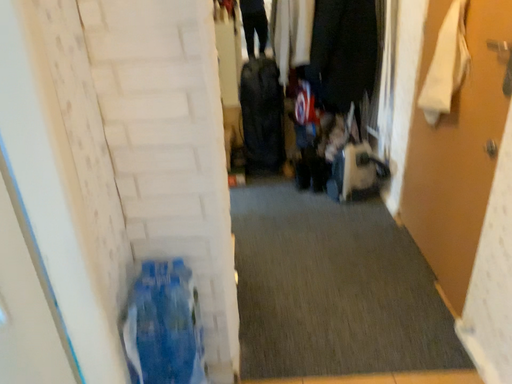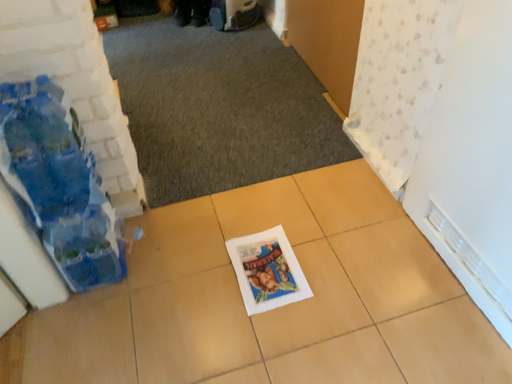
Question: Which way did the camera rotate in the video?

Choices:
 (A) rotated downward
 (B) rotated upward

Answer: (A)